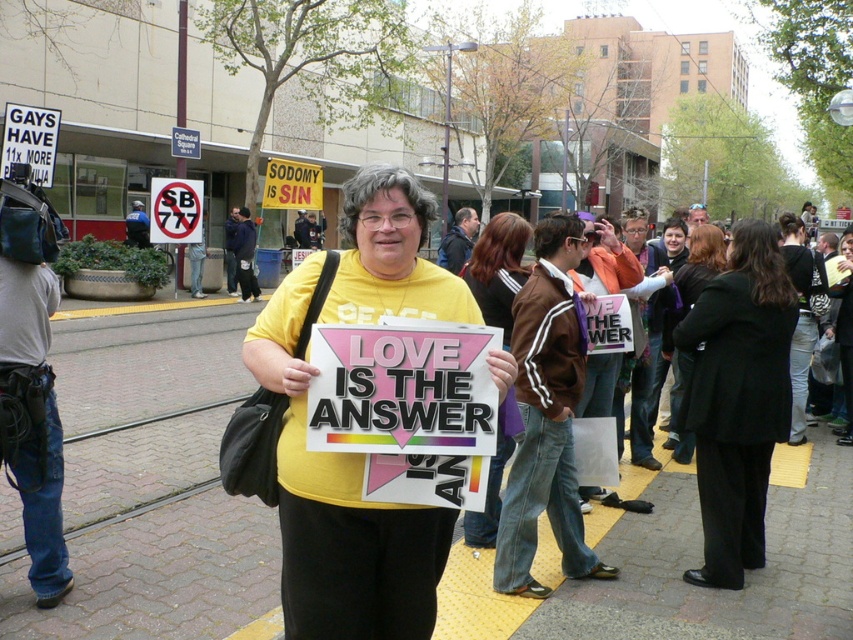
Question: Among these objects, which one is farthest from the camera?

Choices:
 (A) brick pavement at center
 (B) black coat at center
 (C) black leather jacket at center

Answer: (B)

Question: From the image, what is the correct spatial relationship of black wool coat at center in relation to matte yellow shirt at center?

Choices:
 (A) above
 (B) below

Answer: (B)

Question: Does brick pavement at center appear over black coat at center?

Choices:
 (A) yes
 (B) no

Answer: (B)

Question: Is black leather jacket at center to the right of black coat at center from the viewer's perspective?

Choices:
 (A) no
 (B) yes

Answer: (B)

Question: Among these points, which one is nearest to the camera?

Choices:
 (A) (207, 467)
 (B) (688, 276)

Answer: (A)

Question: Estimate the real-world distances between objects in this image. Which object is closer to the brick pavement at center?

Choices:
 (A) black wool coat at center
 (B) black coat at center
 (C) black leather jacket at center

Answer: (B)